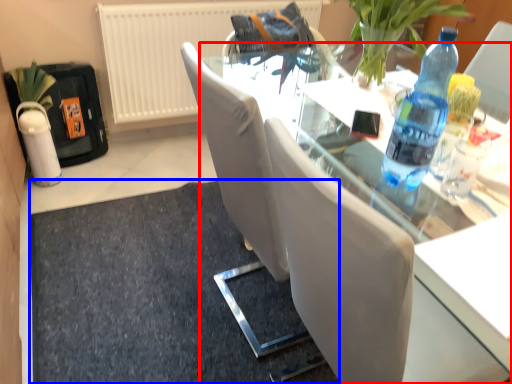
Question: Which of the following is the closest to the observer, table (highlighted by a red box) or doormat (highlighted by a blue box)?

Choices:
 (A) table
 (B) doormat

Answer: (A)